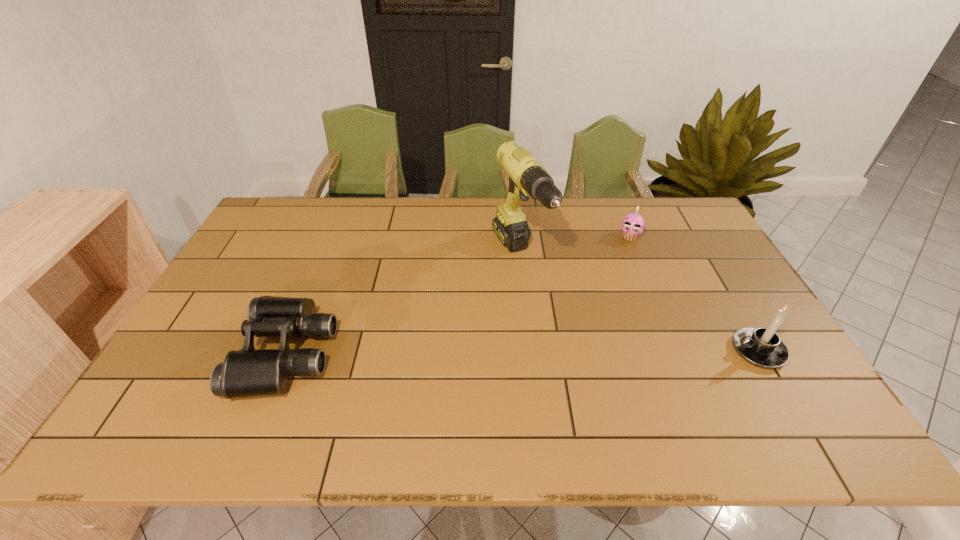
Locate an element on the screen. The image size is (960, 540). blank space located with a handle on the side of the rightmost object is located at coordinates (673, 351).

Identify the location of vacant space located 0.290m with a handle on the side of the rightmost object. The image size is (960, 540). (618, 351).

In order to click on vacant space situated on the handle side of the tallest object in this screenshot , I will do `click(577, 352)`.

Locate an element on the screen. free space located 0.090m on the handle side of the tallest object is located at coordinates (547, 309).

You are a GUI agent. You are given a task and a screenshot of the screen. Output one action in this format:
    pyautogui.click(x=<x>, y=<y>)
    Task: Click on the vacant space located 0.290m on the handle side of the tallest object
    The image size is (960, 540).
    Given the screenshot: What is the action you would take?
    pyautogui.click(x=585, y=364)

Locate an element on the screen. Image resolution: width=960 pixels, height=540 pixels. vacant position located 0.330m on the face of the cupcake is located at coordinates (602, 308).

I want to click on vacant region located on the face of the cupcake, so click(598, 318).

You are a GUI agent. You are given a task and a screenshot of the screen. Output one action in this format:
    pyautogui.click(x=<x>, y=<y>)
    Task: Click on the vacant region located on the face of the cupcake
    
    Given the screenshot: What is the action you would take?
    pyautogui.click(x=613, y=278)

This screenshot has width=960, height=540. Find the location of `drill present at the far edge`. drill present at the far edge is located at coordinates (527, 177).

The width and height of the screenshot is (960, 540). Identify the location of cupcake that is at the far edge. (633, 224).